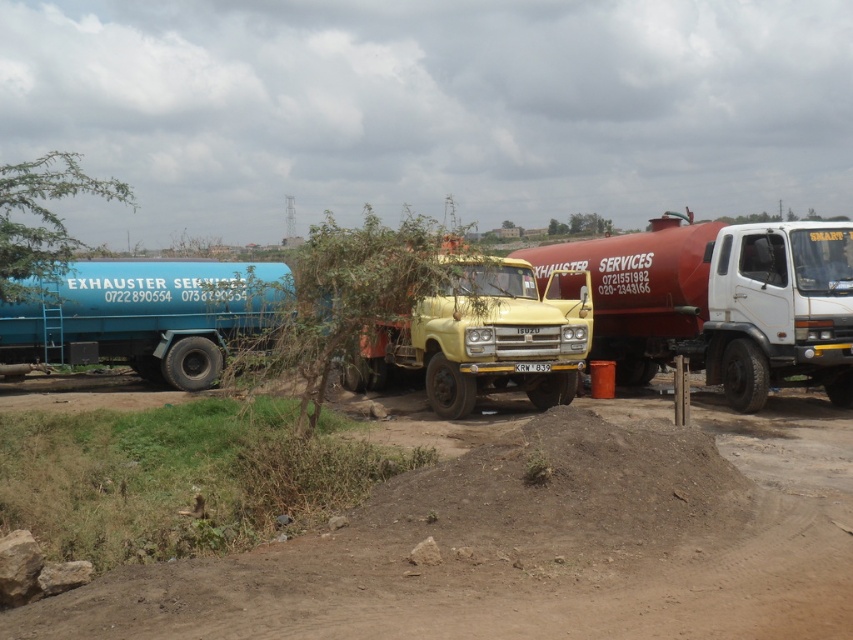
You are a delivery driver who needs to turn around your vehicle on the road. You see a brown dirt track at lower center and a yellow matte truck at center. Which object is positioned to the left of the other?

The brown dirt track at lower center is to the left of the yellow matte truck at center.

Please provide the coordinates of the yellow matte truck at center in the image. The coordinate system is normalized, with the origin at the bottom left corner of the image. The coordinates are represented as a tuple of two decimal numbers between 0 and 1, where the first number is the x coordinate and the second is the y coordinate. The x axis increases to the right, and the y axis increases upwards. Please answer with the coordinates in the format of a tuple, e.g., 0.5, 0.5.

The coordinates of the yellow matte truck at center are at point (482, 336).